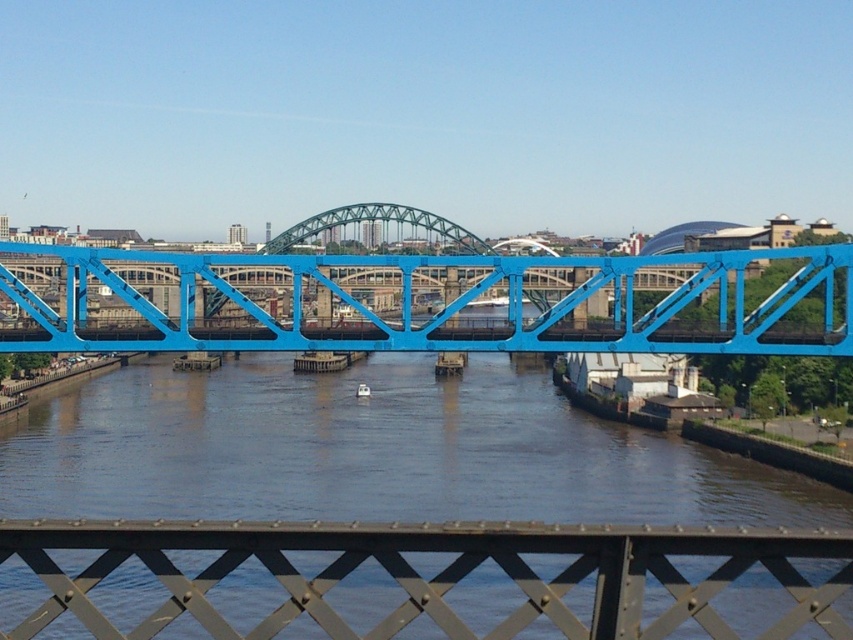
Is blue metallic bridge at center further to camera compared to metallic gray lattice at center?

That is True.

Can you confirm if blue metallic bridge at center is positioned above metallic gray lattice at center?

Yes.

Who is more forward, [64,260] or [405,625]?

Point [405,625] is in front.

This screenshot has width=853, height=640. In order to click on blue metallic bridge at center in this screenshot , I will do `click(440, 308)`.

Which is in front, point (42, 513) or point (747, 253)?

Point (42, 513) is in front.

Between brown matte water at center and blue metallic bridge at center, which one is positioned higher?

blue metallic bridge at center is above.

Is point (392, 416) positioned before point (161, 317)?

No, it is not.

Image resolution: width=853 pixels, height=640 pixels. In order to click on brown matte water at center in this screenshot , I will do `click(373, 452)`.

Who is higher up, brown matte water at center or metallic gray lattice at center?

Positioned higher is brown matte water at center.

Does brown matte water at center have a smaller size compared to metallic gray lattice at center?

Incorrect, brown matte water at center is not smaller in size than metallic gray lattice at center.

Describe the element at coordinates (373, 452) in the screenshot. I see `brown matte water at center` at that location.

You are a GUI agent. You are given a task and a screenshot of the screen. Output one action in this format:
    pyautogui.click(x=<x>, y=<y>)
    Task: Click on the brown matte water at center
    The image size is (853, 640).
    Given the screenshot: What is the action you would take?
    pyautogui.click(x=373, y=452)